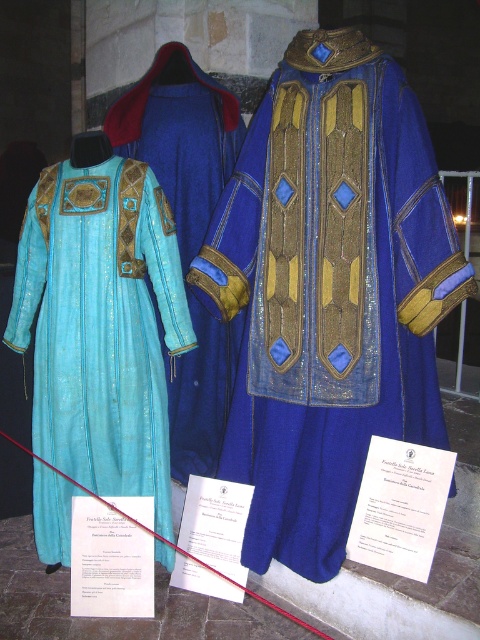
Question: Is blue velvet robe at center positioned before matte blue fabric dress at left?

Choices:
 (A) no
 (B) yes

Answer: (B)

Question: Can you confirm if blue velvet robe at center is thinner than matte blue fabric dress at left?

Choices:
 (A) no
 (B) yes

Answer: (A)

Question: Is blue velvet robe at center further to camera compared to turquoise velvet robe at center?

Choices:
 (A) no
 (B) yes

Answer: (A)

Question: Which is nearer to the blue velvet robe at center?

Choices:
 (A) turquoise velvet robe at center
 (B) matte blue fabric dress at left

Answer: (B)

Question: Considering the real-world distances, which object is farthest from the matte blue fabric dress at left?

Choices:
 (A) turquoise velvet robe at center
 (B) blue velvet robe at center

Answer: (B)

Question: Which point is farther to the camera?

Choices:
 (A) blue velvet robe at center
 (B) matte blue fabric dress at left

Answer: (B)